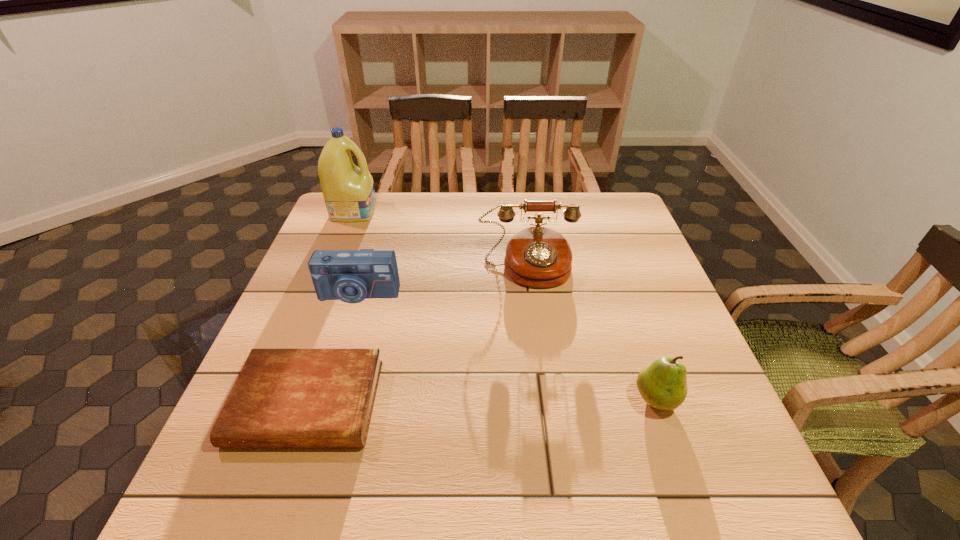
Identify the location of free space located 0.070m on the lens of the camera. This screenshot has height=540, width=960. (348, 327).

Locate an element on the screen. The image size is (960, 540). object located in the far edge section of the desktop is located at coordinates (349, 194).

The width and height of the screenshot is (960, 540). In order to click on detergent present at the left edge in this screenshot , I will do `click(349, 194)`.

Identify the location of camera positioned at the left edge. The width and height of the screenshot is (960, 540). (351, 276).

Image resolution: width=960 pixels, height=540 pixels. I want to click on Bible that is positioned at the left edge, so click(x=282, y=397).

You are a GUI agent. You are given a task and a screenshot of the screen. Output one action in this format:
    pyautogui.click(x=<x>, y=<y>)
    Task: Click on the object located in the right edge section of the desktop
    
    Given the screenshot: What is the action you would take?
    pyautogui.click(x=662, y=384)

Locate an element on the screen. object located at the far left corner is located at coordinates (349, 194).

In the image, there is a desktop. Identify the location of free region at the far edge. The height and width of the screenshot is (540, 960). (469, 197).

At what (x,y) coordinates should I click in order to perform the action: click on free location at the near edge of the desktop. Please return your answer as a coordinate pair (x, y). The height and width of the screenshot is (540, 960). Looking at the image, I should click on point(525,498).

The image size is (960, 540). I want to click on vacant space at the left edge of the desktop, so click(230, 456).